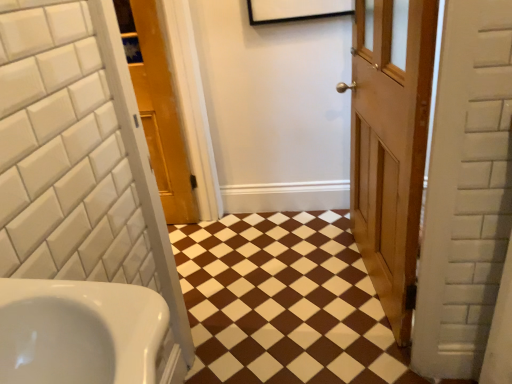
Question: Is brown glossy tile at center in front of or behind white glossy sink at lower left in the image?

Choices:
 (A) behind
 (B) front

Answer: (A)

Question: Is brown glossy tile at center taller or shorter than white glossy sink at lower left?

Choices:
 (A) short
 (B) tall

Answer: (A)

Question: Which of these objects is positioned farthest from the brown glossy tile at center?

Choices:
 (A) wooden door at center, which ranks as the 2th door in left-to-right order
 (B) wooden door at center, which ranks as the second door in right-to-left order
 (C) white glossy sink at lower left

Answer: (C)

Question: Which of these objects is positioned closest to the wooden door at center, the 1th door when ordered from right to left?

Choices:
 (A) white glossy sink at lower left
 (B) brown glossy tile at center
 (C) wooden door at center, which ranks as the second door in right-to-left order

Answer: (B)